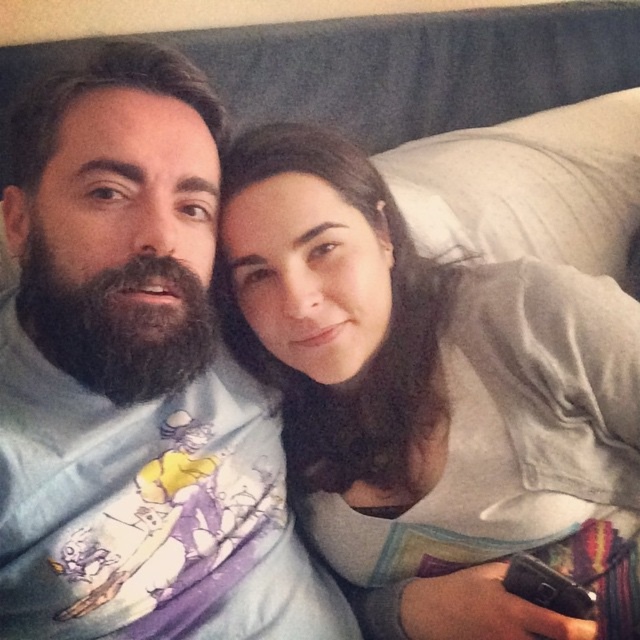
Question: In this image, where is light blue cotton shirt at center located relative to white soft pillow at upper right?

Choices:
 (A) below
 (B) above

Answer: (A)

Question: Does light blue cotton shirt at center have a larger size compared to white soft pillow at upper right?

Choices:
 (A) yes
 (B) no

Answer: (B)

Question: Does smooth gray shirt at center appear on the left side of white soft pillow at upper right?

Choices:
 (A) no
 (B) yes

Answer: (B)

Question: Which point is farther to the camera?

Choices:
 (A) white soft pillow at upper right
 (B) smooth gray shirt at center
 (C) light blue cotton shirt at center

Answer: (A)

Question: Which object is closer to the camera taking this photo?

Choices:
 (A) smooth gray shirt at center
 (B) light blue cotton shirt at center
 (C) white soft pillow at upper right

Answer: (B)

Question: Which point is farther from the camera taking this photo?

Choices:
 (A) pyautogui.click(x=620, y=154)
 (B) pyautogui.click(x=365, y=371)
 (C) pyautogui.click(x=193, y=528)

Answer: (A)